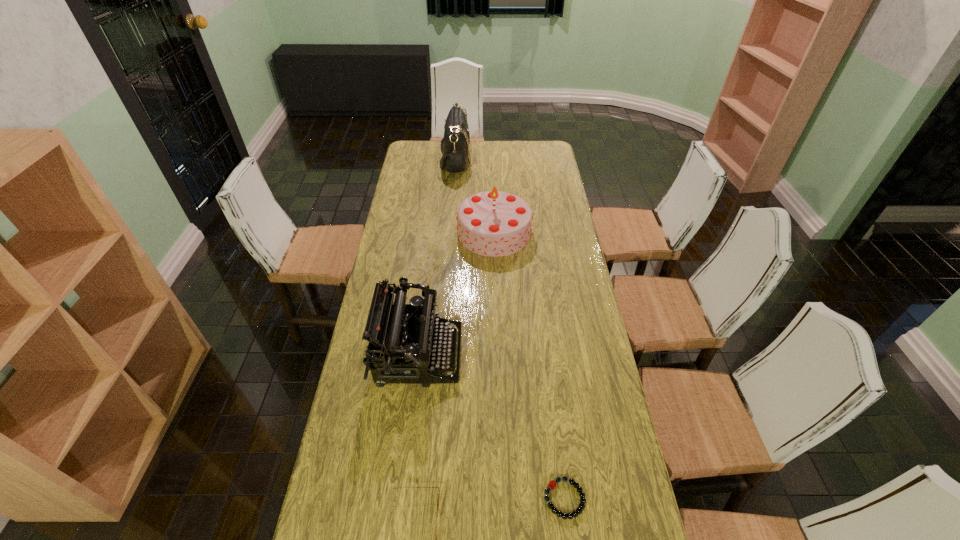
You are a GUI agent. You are given a task and a screenshot of the screen. Output one action in this format:
    pyautogui.click(x=<x>, y=<y>)
    Task: Click on the object at the right edge
    The width and height of the screenshot is (960, 540).
    Given the screenshot: What is the action you would take?
    pyautogui.click(x=552, y=484)

The height and width of the screenshot is (540, 960). In the image, there is a desktop. Find the location of `vacant region at the far edge`. vacant region at the far edge is located at coordinates (476, 160).

At what (x,y) coordinates should I click in order to perform the action: click on vacant space at the left edge. Please return your answer as a coordinate pair (x, y). This screenshot has width=960, height=540. Looking at the image, I should click on (396, 249).

In the image, there is a desktop. Where is `vacant space at the right edge`? The width and height of the screenshot is (960, 540). vacant space at the right edge is located at coordinates (624, 464).

Locate an element on the screen. The height and width of the screenshot is (540, 960). free spot at the far left corner of the desktop is located at coordinates (407, 153).

Identify the location of vacant space at the far right corner of the desktop. The height and width of the screenshot is (540, 960). (528, 163).

Find the location of a particular element. free space between the third farthest object and the fourth nearest object is located at coordinates (456, 294).

The width and height of the screenshot is (960, 540). In order to click on free space between the typewriter and the fourth nearest object in this screenshot , I will do `click(456, 294)`.

Where is `vacant area that lies between the typewriter and the bracelet`? vacant area that lies between the typewriter and the bracelet is located at coordinates (492, 427).

Where is `vacant space that's between the shortest object and the fourth nearest object`? The height and width of the screenshot is (540, 960). vacant space that's between the shortest object and the fourth nearest object is located at coordinates (529, 365).